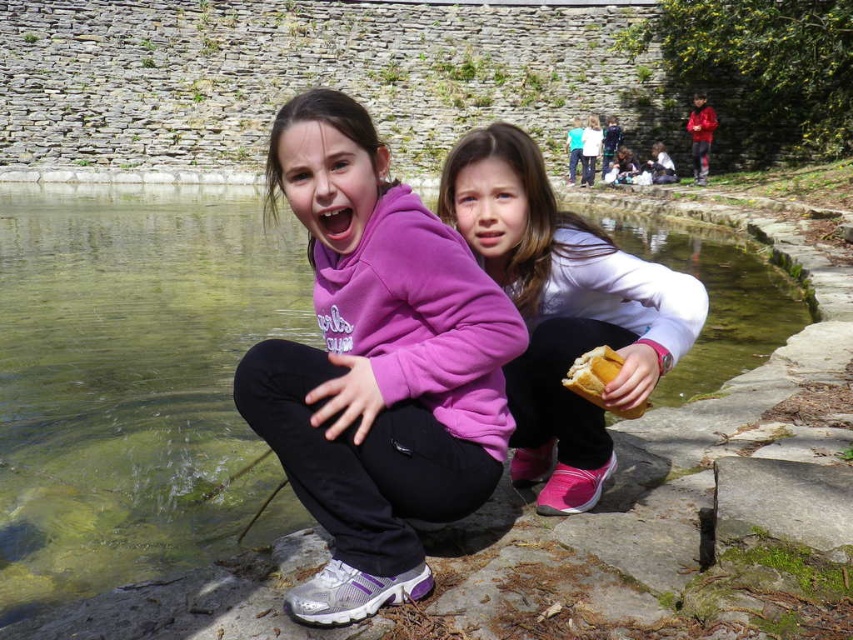
Question: Is clear water at lake center below golden bread at lower center?

Choices:
 (A) yes
 (B) no

Answer: (B)

Question: Based on their relative distances, which object is farther from the golden bread at lower center?

Choices:
 (A) clear water at lake center
 (B) white matte jacket at center

Answer: (A)

Question: Which is farther from the golden bread at lower center?

Choices:
 (A) clear water at lake center
 (B) white matte jacket at center

Answer: (A)

Question: Which object is positioned farthest from the golden bread at lower center?

Choices:
 (A) clear water at lake center
 (B) white matte jacket at center

Answer: (A)

Question: Does clear water at lake center appear on the left side of white matte jacket at center?

Choices:
 (A) no
 (B) yes

Answer: (B)

Question: From the image, what is the correct spatial relationship of clear water at lake center in relation to white matte jacket at center?

Choices:
 (A) right
 (B) left

Answer: (B)